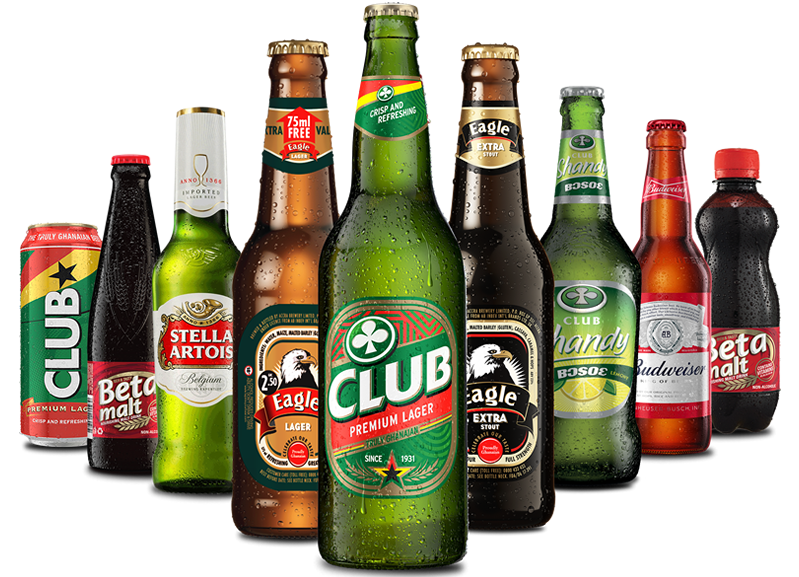
The image size is (799, 577). I want to click on glass bottles, so click(117, 354), click(193, 319), click(281, 324), click(419, 282), click(498, 275), click(575, 260), click(661, 266).